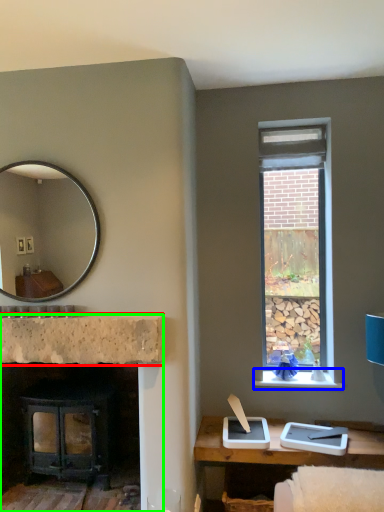
Question: Which object is the closest to the counter top (highlighted by a red box)? Choose among these: window sill (highlighted by a blue box) or fireplace (highlighted by a green box).

Choices:
 (A) window sill
 (B) fireplace

Answer: (B)